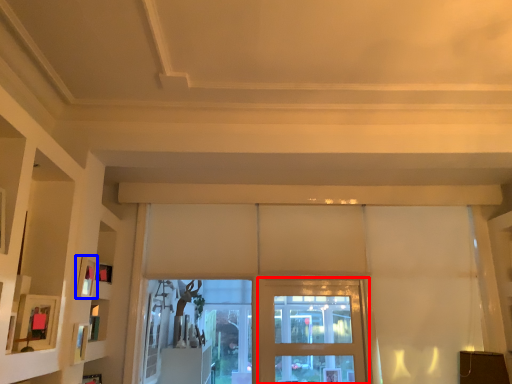
Question: Which of the following is the farthest to the observer, screen door (highlighted by a red box) or picture frame (highlighted by a blue box)?

Choices:
 (A) screen door
 (B) picture frame

Answer: (A)